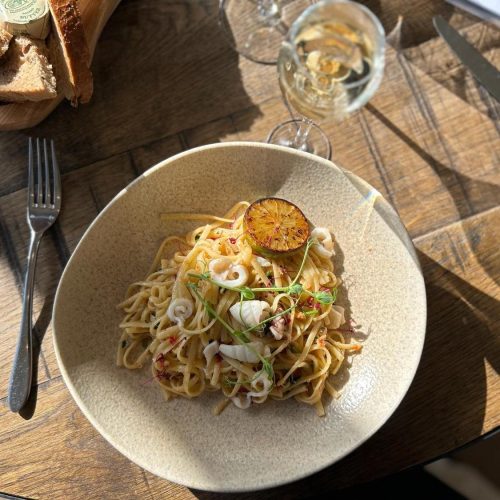
Locate an element on the screen. The width and height of the screenshot is (500, 500). stoneware plate is located at coordinates (381, 258).